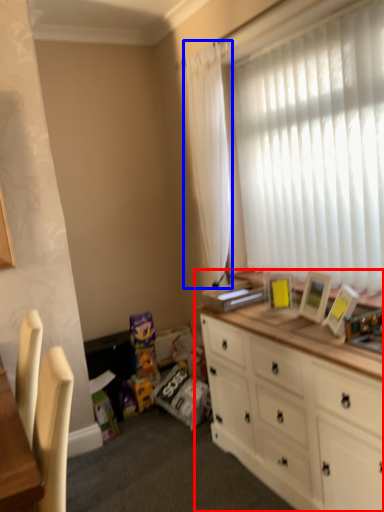
Question: Which object appears closest to the camera in this image, cabinetry (highlighted by a red box) or curtain (highlighted by a blue box)?

Choices:
 (A) cabinetry
 (B) curtain

Answer: (A)